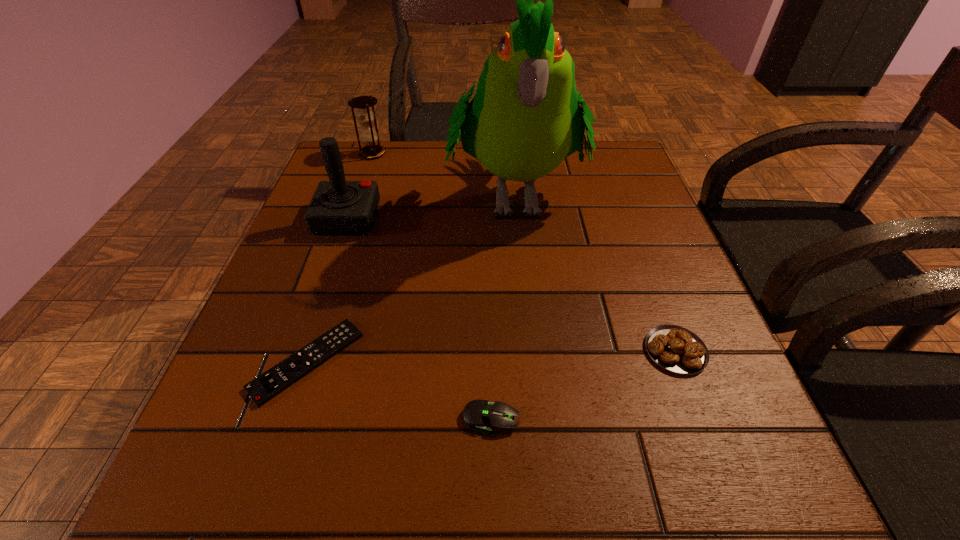
The width and height of the screenshot is (960, 540). In order to click on vacant region located 0.340m on the left of the pastry in this screenshot , I will do `click(442, 350)`.

Image resolution: width=960 pixels, height=540 pixels. In order to click on free location located on the left of the computer mouse in this screenshot , I will do `click(354, 418)`.

Where is `vacant area situated on the front of the shortest object`? This screenshot has width=960, height=540. vacant area situated on the front of the shortest object is located at coordinates (261, 500).

You are a GUI agent. You are given a task and a screenshot of the screen. Output one action in this format:
    pyautogui.click(x=<x>, y=<y>)
    Task: Click on the parakeet that is at the far edge
    The image size is (960, 540).
    Given the screenshot: What is the action you would take?
    pyautogui.click(x=524, y=119)

Locate an element on the screen. Image resolution: width=960 pixels, height=540 pixels. hourglass that is at the far edge is located at coordinates (369, 137).

The image size is (960, 540). Find the location of `joystick at the left edge`. joystick at the left edge is located at coordinates click(338, 207).

Where is `hourglass situated at the left edge`? hourglass situated at the left edge is located at coordinates (369, 137).

Locate an element on the screen. remote control positioned at the left edge is located at coordinates (269, 384).

Find the location of a particular element. The image size is (960, 540). parakeet at the right edge is located at coordinates (524, 119).

The height and width of the screenshot is (540, 960). In order to click on pastry at the right edge in this screenshot , I will do `click(676, 349)`.